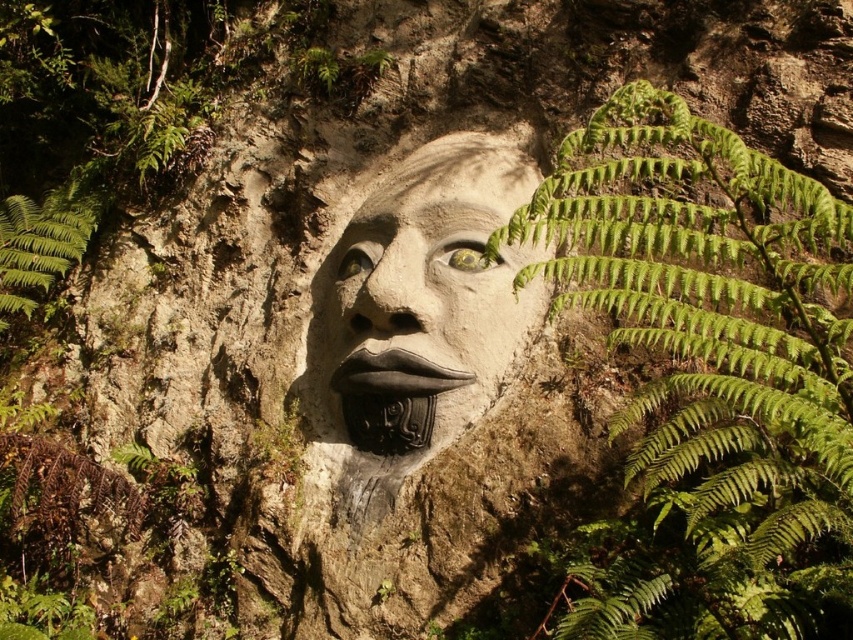
You are an artist trying to sketch the carved stone face. You notice two green leafy ferns framing it. Which fern, the green leafy fern at right or the green leafy fern at left, would you need to draw larger to accurately represent the scene?

The green leafy fern at right is bigger than the green leafy fern at left, so you should draw the green leafy fern at right larger to accurately represent the scene.